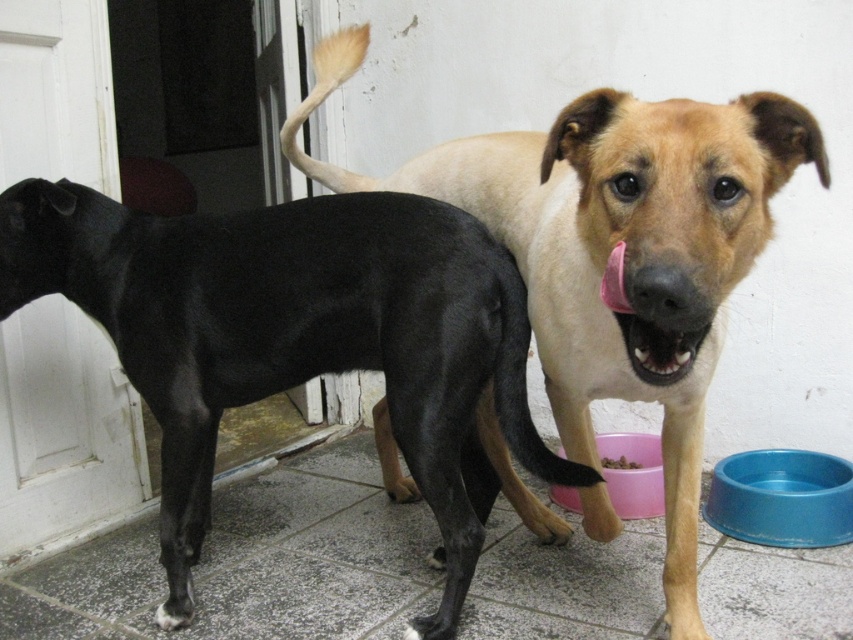
Question: Does black smooth dog at left have a lesser width compared to light brown fur dog at center?

Choices:
 (A) yes
 (B) no

Answer: (B)

Question: Among these points, which one is nearest to the camera?

Choices:
 (A) (607, 458)
 (B) (51, 189)
 (C) (596, 173)

Answer: (C)

Question: Among these points, which one is farthest from the camera?

Choices:
 (A) (556, 129)
 (B) (399, 374)
 (C) (614, 458)

Answer: (C)

Question: Which object is positioned closest to the light brown fur dog at center?

Choices:
 (A) black smooth dog at left
 (B) brown crumbly food at lower center

Answer: (A)

Question: Is light brown fur dog at center above brown crumbly food at lower center?

Choices:
 (A) yes
 (B) no

Answer: (A)

Question: Is black smooth dog at left to the left of brown crumbly food at lower center from the viewer's perspective?

Choices:
 (A) yes
 (B) no

Answer: (A)